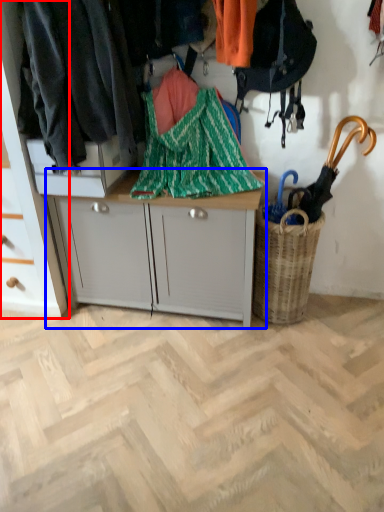
Question: Among these objects, which one is nearest to the camera, cabinetry (highlighted by a red box) or desk (highlighted by a blue box)?

Choices:
 (A) cabinetry
 (B) desk

Answer: (A)